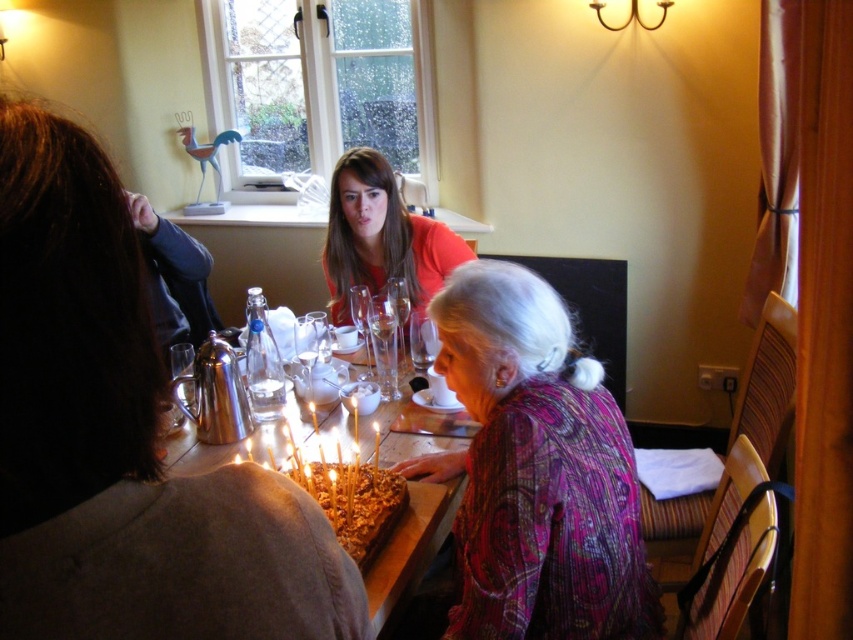
Question: Can you confirm if patterned fabric blouse at center is bigger than clear glass wine glass at center?

Choices:
 (A) yes
 (B) no

Answer: (A)

Question: Which point is farther to the camera?

Choices:
 (A) (399, 348)
 (B) (376, 618)
 (C) (437, 282)

Answer: (C)

Question: Does matte orange shirt at center have a greater width compared to clear glass wine glass at center?

Choices:
 (A) no
 (B) yes

Answer: (B)

Question: Is patterned fabric blouse at center positioned in front of candle-lit cake at center?

Choices:
 (A) yes
 (B) no

Answer: (A)

Question: Which point is closer to the camera?

Choices:
 (A) clear glass wine glass at center
 (B) crispy golden cake at center
 (C) candle-lit cake at center
 (D) patterned fabric blouse at center

Answer: (D)

Question: Which is nearer to the patterned fabric blouse at center?

Choices:
 (A) candle-lit cake at center
 (B) clear glass wine glass at center

Answer: (A)